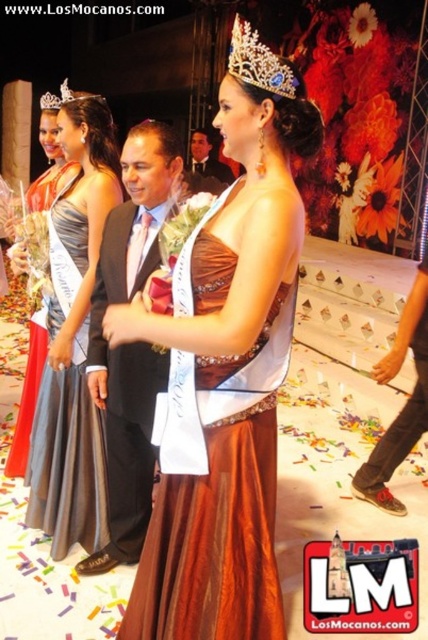
Question: Which of the following is the farthest from the observer?

Choices:
 (A) diamond encrusted tiara at upper center
 (B) matte silver gown at left
 (C) silver metallic tiara at upper center
 (D) dark suit at center

Answer: (B)

Question: Does dark suit at center appear on the right side of matte silver gown at left?

Choices:
 (A) no
 (B) yes

Answer: (B)

Question: Is the position of diamond encrusted tiara at upper center less distant than that of silver metallic tiara at upper center?

Choices:
 (A) yes
 (B) no

Answer: (A)

Question: Which of these objects is positioned farthest from the shiny brown dress at center?

Choices:
 (A) satin silver dress at left
 (B) matte silver gown at left

Answer: (B)

Question: In this image, where is dark suit at center located relative to silver metallic tiara at upper center?

Choices:
 (A) above
 (B) below

Answer: (B)

Question: Which object is positioned closest to the shiny brown dress at center?

Choices:
 (A) matte black suit at center
 (B) matte silver gown at left
 (C) silver metallic tiara at upper center
 (D) diamond encrusted tiara at upper center

Answer: (D)